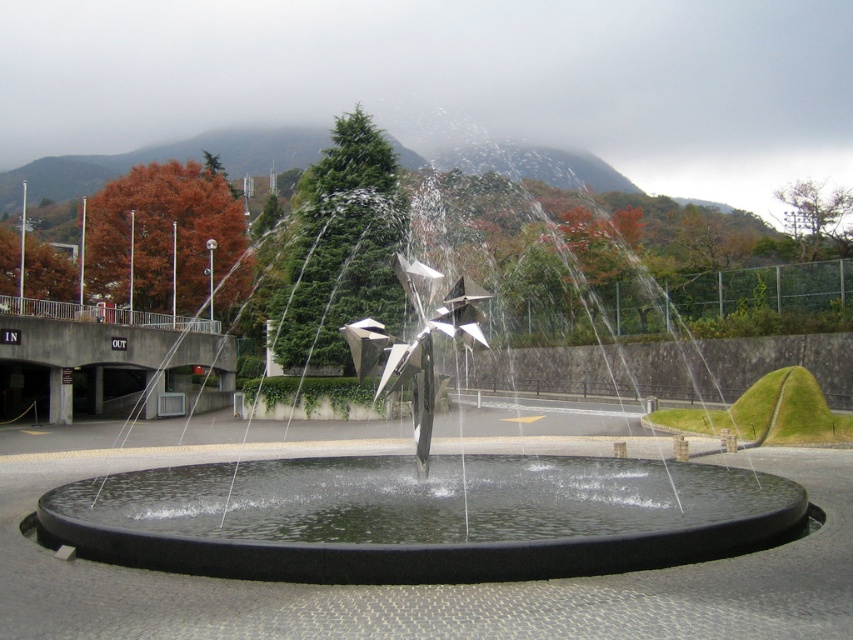
Question: Observing the image, what is the correct spatial positioning of black polished water at center in reference to metallic sculpture at center?

Choices:
 (A) below
 (B) above

Answer: (A)

Question: Which of the following is the closest to the observer?

Choices:
 (A) (416, 355)
 (B) (276, 464)
 (C) (514, 573)

Answer: (C)

Question: Does polished metal fountain at center appear over metallic sculpture at center?

Choices:
 (A) yes
 (B) no

Answer: (A)

Question: Which object appears closest to the camera in this image?

Choices:
 (A) metallic sculpture at center
 (B) polished metal fountain at center

Answer: (B)

Question: Which of these objects is positioned closest to the metallic sculpture at center?

Choices:
 (A) polished metal fountain at center
 (B) black polished water at center

Answer: (A)

Question: Is polished metal fountain at center further to the viewer compared to black polished water at center?

Choices:
 (A) no
 (B) yes

Answer: (A)